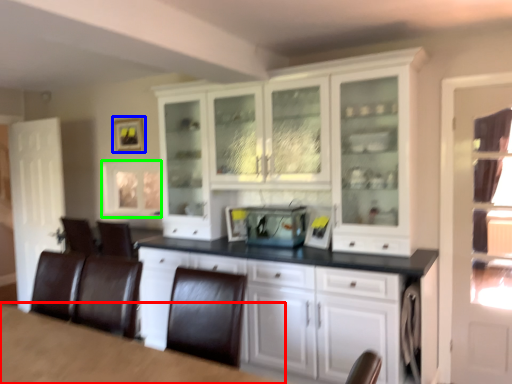
Question: Which object is the farthest from table (highlighted by a red box)? Choose among these: picture frame (highlighted by a blue box) or window (highlighted by a green box).

Choices:
 (A) picture frame
 (B) window

Answer: (A)